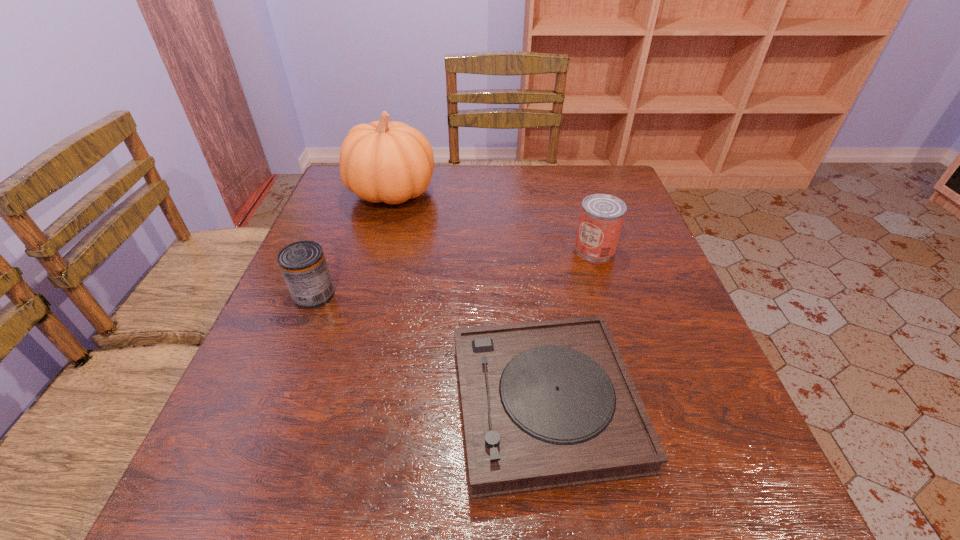
Image resolution: width=960 pixels, height=540 pixels. In order to click on unoccupied area between the pumpkin and the third nearest object in this screenshot , I will do `click(493, 220)`.

The image size is (960, 540). I want to click on free space that is in between the left can and the farther can, so click(455, 271).

In order to click on vacant area that lies between the tallest object and the farther can in this screenshot , I will do `click(493, 220)`.

What are the coordinates of `empty space that is in between the third nearest object and the third farthest object` in the screenshot? It's located at (455, 271).

At what (x,y) coordinates should I click in order to perform the action: click on vacant space that's between the phonograph record and the pumpkin. Please return your answer as a coordinate pair (x, y). The image size is (960, 540). Looking at the image, I should click on click(468, 298).

Choose which object is the nearest neighbor to the left can. Please provide its 2D coordinates. Your answer should be formatted as a tuple, i.e. [(x, y)], where the tuple contains the x and y coordinates of a point satisfying the conditions above.

[(392, 162)]

The image size is (960, 540). In order to click on object that is the second nearest to the farthest object in this screenshot , I will do coord(601,219).